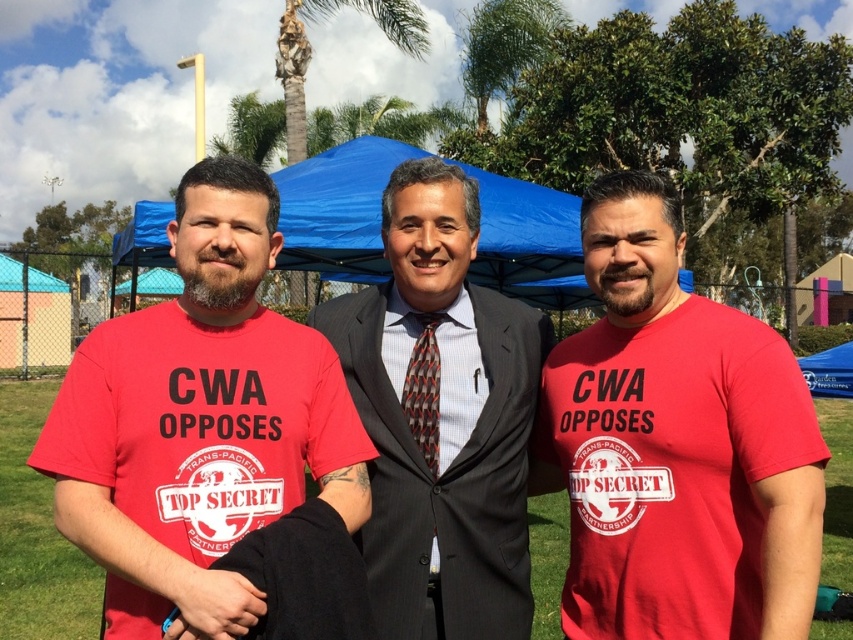
Question: Does dark gray textured suit at center have a lesser width compared to teal fabric canopy at upper left?

Choices:
 (A) yes
 (B) no

Answer: (B)

Question: Can you confirm if blue fabric canopy at center is positioned below brown textured tie at center?

Choices:
 (A) no
 (B) yes

Answer: (A)

Question: Which of the following is the farthest from the observer?

Choices:
 (A) dark gray textured suit at center
 (B) matte red t-shirt at center
 (C) matte red t-shirt at left

Answer: (A)

Question: Which of the following is the closest to the observer?

Choices:
 (A) (244, 600)
 (B) (310, 212)
 (C) (399, 380)

Answer: (A)

Question: From the image, what is the correct spatial relationship of matte red t-shirt at left in relation to teal fabric canopy at upper left?

Choices:
 (A) above
 (B) below

Answer: (B)

Question: Which of the following is the farthest from the observer?

Choices:
 (A) matte red t-shirt at left
 (B) teal fabric canopy at upper left
 (C) smooth black suit at center
 (D) dark gray textured suit at center

Answer: (B)